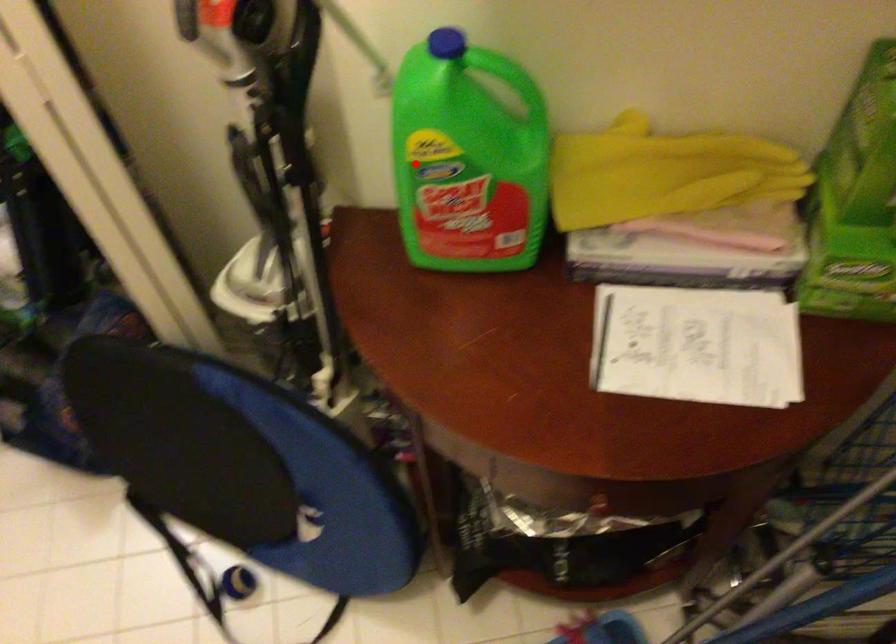
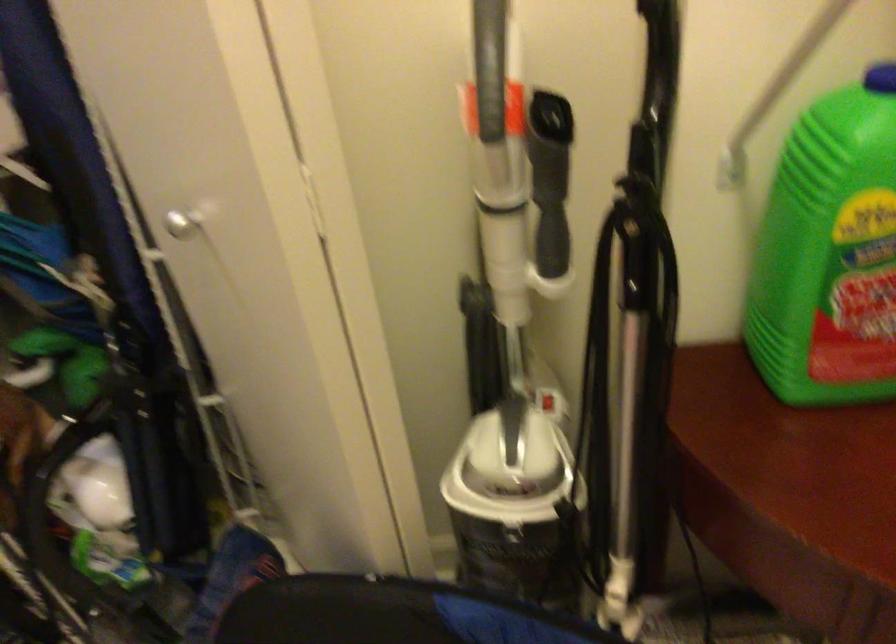
Question: I am providing you with two images of the same scene from different viewpoints. Given a red point in image1, look at the same physical point in image2. Is it:

Choices:
 (A) Closer to the viewpoint
 (B) Farther from the viewpoint

Answer: (A)